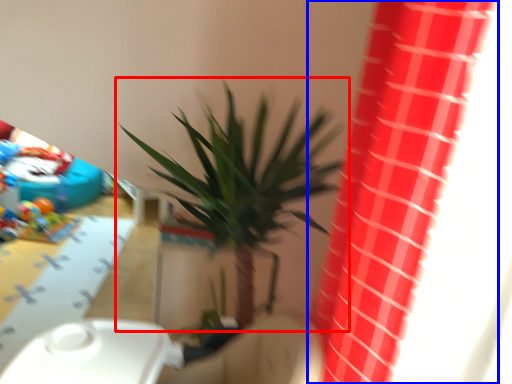
Question: Which object is closer to the camera taking this photo, houseplant (highlighted by a red box) or curtain (highlighted by a blue box)?

Choices:
 (A) houseplant
 (B) curtain

Answer: (B)